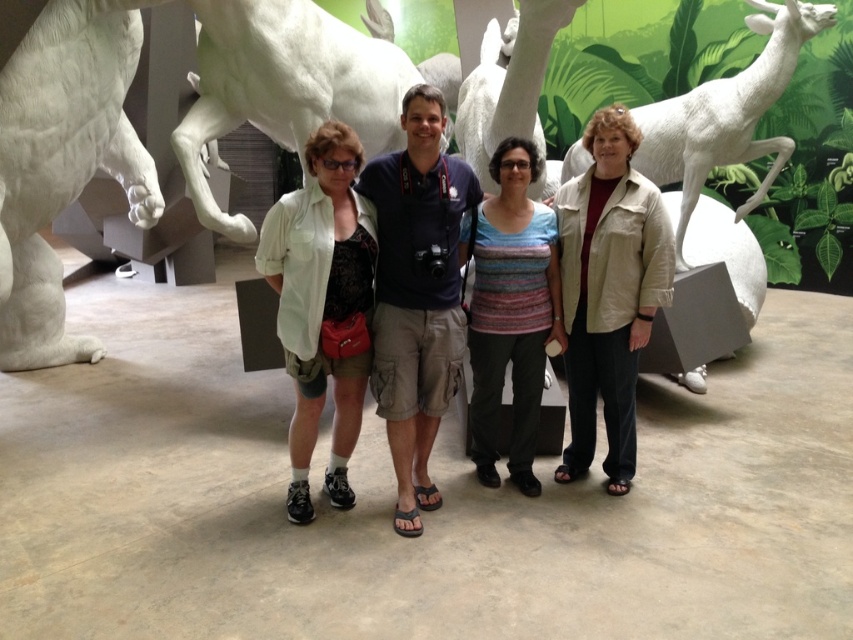
Is beige fabric jacket at center smaller than striped knit top at center?

Actually, beige fabric jacket at center might be larger than striped knit top at center.

The height and width of the screenshot is (640, 853). What do you see at coordinates (608, 291) in the screenshot?
I see `beige fabric jacket at center` at bounding box center [608, 291].

Is point (618, 330) farther from camera compared to point (490, 161)?

That is False.

Identify the location of beige fabric jacket at center. (608, 291).

Between white cotton shirt at center and white matte deer at right, which one has more height?

white matte deer at right is taller.

Locate an element on the screen. Image resolution: width=853 pixels, height=640 pixels. white cotton shirt at center is located at coordinates (322, 305).

What are the coordinates of `white cotton shirt at center` in the screenshot? It's located at (322, 305).

Is the position of beige fabric jacket at center more distant than that of white cotton shirt at center?

Yes, beige fabric jacket at center is behind white cotton shirt at center.

Can you confirm if beige fabric jacket at center is bigger than white cotton shirt at center?

Yes, beige fabric jacket at center is bigger than white cotton shirt at center.

Who is more forward, (613,397) or (288,502)?

Positioned in front is point (288,502).

The width and height of the screenshot is (853, 640). Identify the location of beige fabric jacket at center. (608, 291).